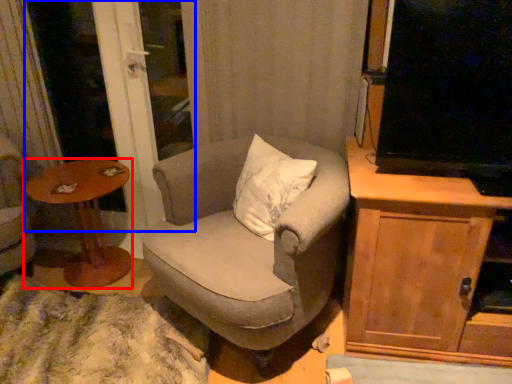
Question: Which of the following is the closest to the observer, table (highlighted by a red box) or screen door (highlighted by a blue box)?

Choices:
 (A) table
 (B) screen door

Answer: (A)